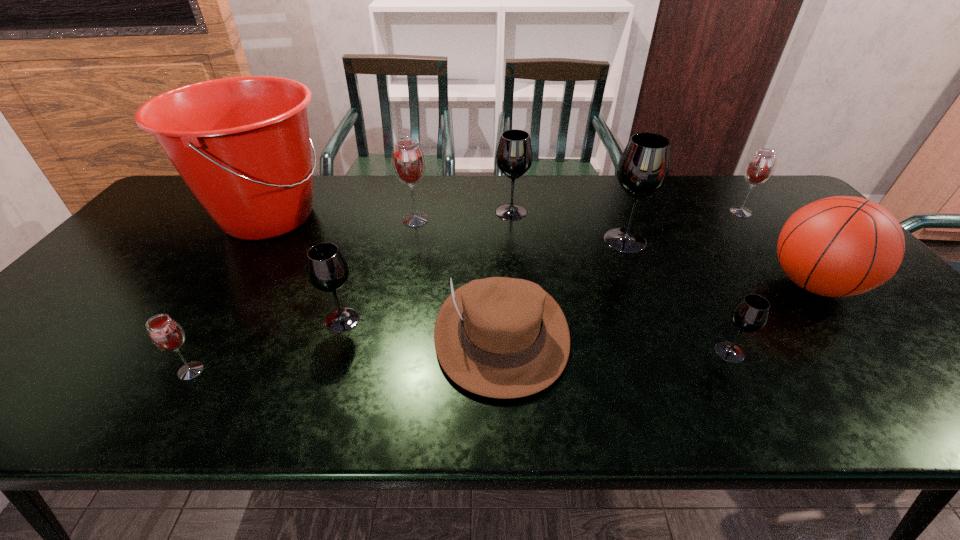
Find the location of a particular element. This screenshot has height=540, width=960. unoccupied area between the third gray wineglass from right to left and the rightmost red wineglass is located at coordinates (626, 212).

Locate an element on the screen. Image resolution: width=960 pixels, height=540 pixels. vacant space that's between the fedora and the rightmost gray wineglass is located at coordinates (615, 343).

Where is `vacant area that lies between the leftmost wineglass and the fedora`? The image size is (960, 540). vacant area that lies between the leftmost wineglass and the fedora is located at coordinates (347, 352).

You are a GUI agent. You are given a task and a screenshot of the screen. Output one action in this format:
    pyautogui.click(x=<x>, y=<y>)
    Task: Click on the free point between the rightmost wineglass and the basketball
    The height and width of the screenshot is (540, 960).
    Given the screenshot: What is the action you would take?
    pyautogui.click(x=777, y=248)

The width and height of the screenshot is (960, 540). Find the location of `vacant area between the tallest object and the second tallest object`. vacant area between the tallest object and the second tallest object is located at coordinates tap(446, 228).

The height and width of the screenshot is (540, 960). I want to click on vacant space in between the fedora and the nearest gray wineglass, so click(615, 343).

The width and height of the screenshot is (960, 540). I want to click on vacant space that is in between the fifth wineglass from left to right and the basketball, so pyautogui.click(x=719, y=262).

Identify which object is located as the second nearest to the rightmost wineglass. Please provide its 2D coordinates. Your answer should be formatted as a tuple, i.e. [(x, y)], where the tuple contains the x and y coordinates of a point satisfying the conditions above.

[(643, 168)]

Locate an element on the screen. The width and height of the screenshot is (960, 540). object that ranks as the eighth closest to the second wineglass from left to right is located at coordinates point(840,246).

Choose which wineglass is the third nearest neighbor to the fifth wineglass from right to left. Please provide its 2D coordinates. Your answer should be formatted as a tuple, i.e. [(x, y)], where the tuple contains the x and y coordinates of a point satisfying the conditions above.

[(643, 168)]